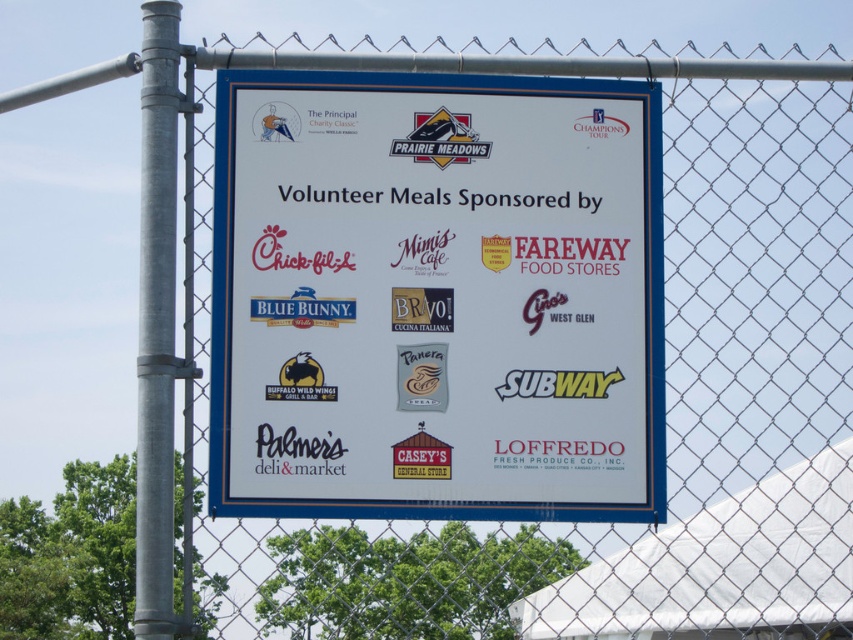
What are the coordinates of the white paper sign at center?

The white paper sign at center is located at point (436, 300).

You are a pedestrian walking past the signboard. You notice the galvanized metal pole at left and the matte red sign at center. Which object is positioned lower in the image?

The galvanized metal pole at left is positioned below the matte red sign at center, so it is lower in the image.

In the scene shown: You are standing in front of the signboard and want to take a photo of the matte red sign at center without including the galvanized metal pole at left. Which direction should you move to achieve this?

Move to the right so that the galvanized metal pole at left is no longer in the frame, allowing you to capture the matte red sign at center without the pole.